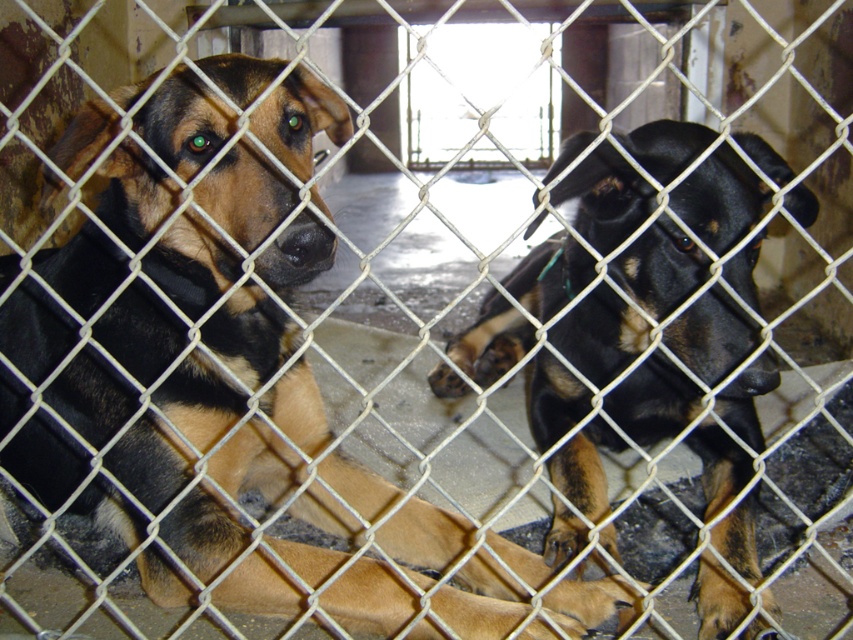
Question: Is black fur dog at left bigger than black glossy dog at center?

Choices:
 (A) no
 (B) yes

Answer: (B)

Question: Which point is closer to the camera?

Choices:
 (A) black fur dog at left
 (B) black glossy dog at center

Answer: (A)

Question: In this image, where is black fur dog at left located relative to black glossy dog at center?

Choices:
 (A) below
 (B) above

Answer: (B)

Question: Among these objects, which one is farthest from the camera?

Choices:
 (A) black fur dog at left
 (B) black glossy dog at center

Answer: (B)

Question: Which of the following is the closest to the observer?

Choices:
 (A) (178, 257)
 (B) (625, 300)

Answer: (B)

Question: Is black fur dog at left further to camera compared to black glossy dog at center?

Choices:
 (A) no
 (B) yes

Answer: (A)